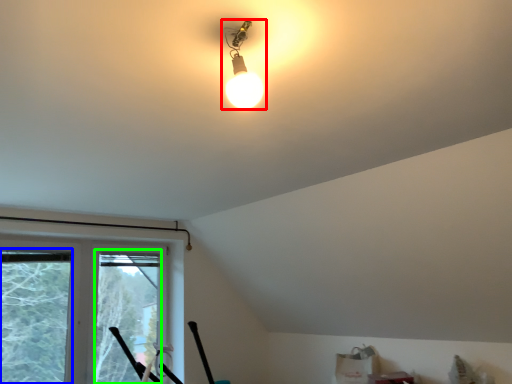
Question: Which is nearer to the lamp (highlighted by a red box)? window screen (highlighted by a blue box) or window screen (highlighted by a green box).

Choices:
 (A) window screen
 (B) window screen

Answer: (A)